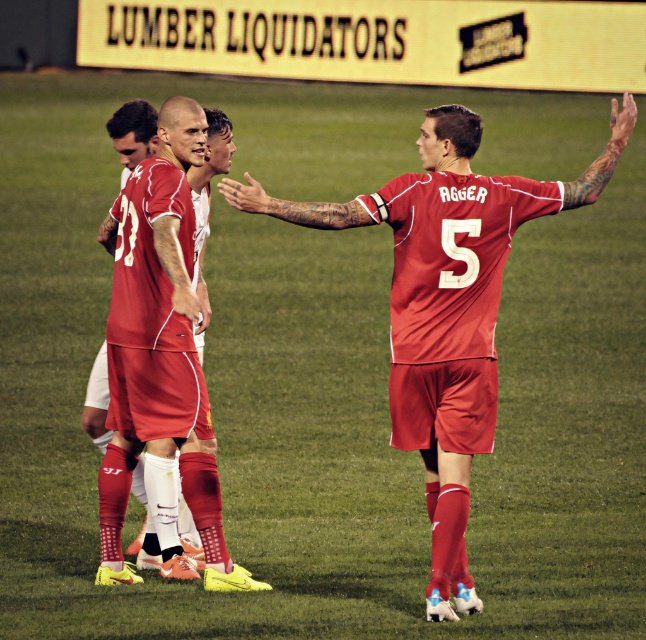
You are a soccer coach observing the team formation during a match. You notice the matte red jersey at center and the matte red soccer uniform at center. Which one is located more to the right side?

The matte red jersey at center is positioned on the right side of the matte red soccer uniform at center, so the matte red jersey at center is more to the right.

You are a soccer coach analyzing a play from the sidelines. You notice a point at coordinates (x=446, y=305) on the field. Based on the scene, what object is located at this point?

The point at coordinates (x=446, y=305) corresponds to the matte red jersey at center.

You are a photographer standing at the edge of the soccer field. You notice two red items at the center of the image. One is labeled as the matte red jersey at center and the other as the matte red soccer uniform at center. Which of these two items appears taller in the image?

The matte red jersey at center appears taller than the matte red soccer uniform at center in the image.